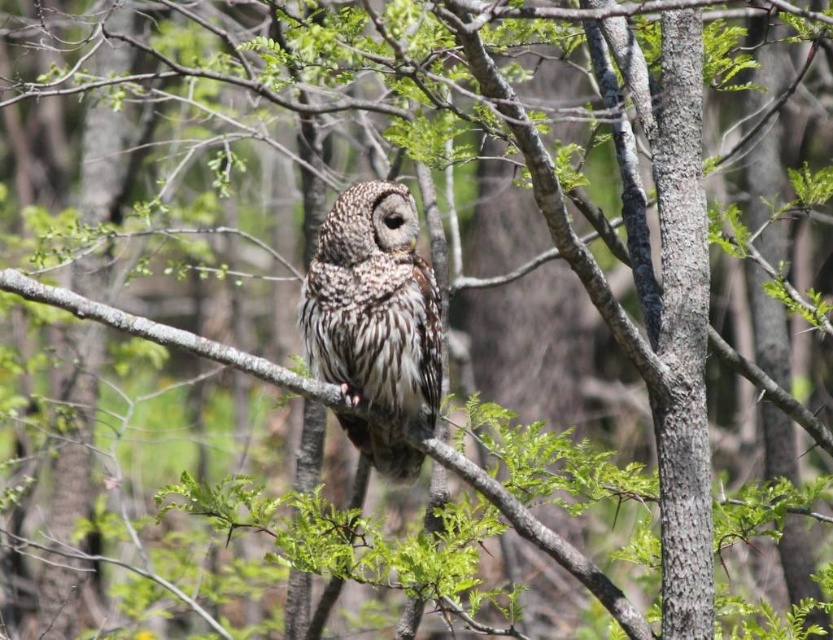
Question: Which point is farther to the camera?

Choices:
 (A) (597, 595)
 (B) (350, 301)

Answer: (A)

Question: Can you confirm if speckled feathered owl at center is smaller than brown textured branch at center?

Choices:
 (A) no
 (B) yes

Answer: (B)

Question: Considering the relative positions of speckled feathered owl at center and brown textured branch at center in the image provided, where is speckled feathered owl at center located with respect to brown textured branch at center?

Choices:
 (A) below
 (B) above

Answer: (B)

Question: Does speckled feathered owl at center have a smaller size compared to brown textured branch at center?

Choices:
 (A) no
 (B) yes

Answer: (B)

Question: Which point is closer to the camera taking this photo?

Choices:
 (A) (228, 352)
 (B) (435, 292)

Answer: (A)